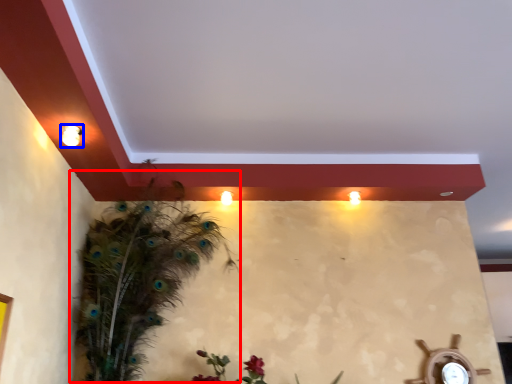
Question: Which object is closer to the camera taking this photo, bird (highlighted by a red box) or light fixture (highlighted by a blue box)?

Choices:
 (A) bird
 (B) light fixture

Answer: (B)